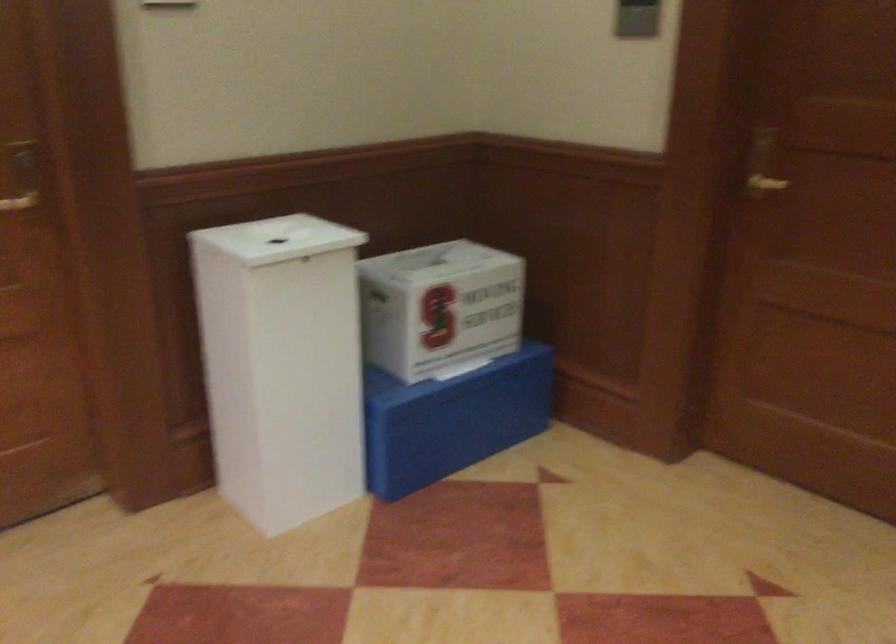
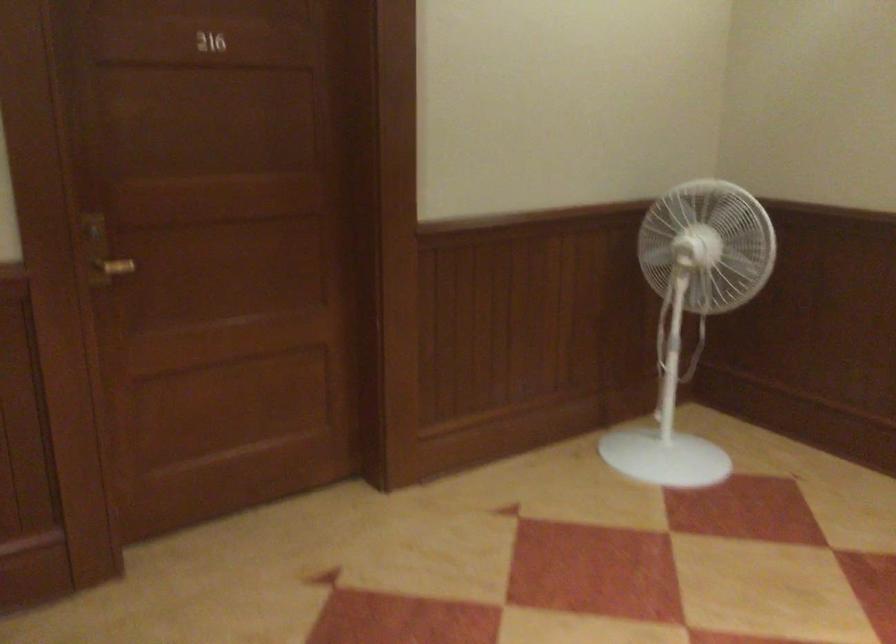
Where in the second image is the point corresponding to (x=747, y=166) from the first image?

(101, 252)